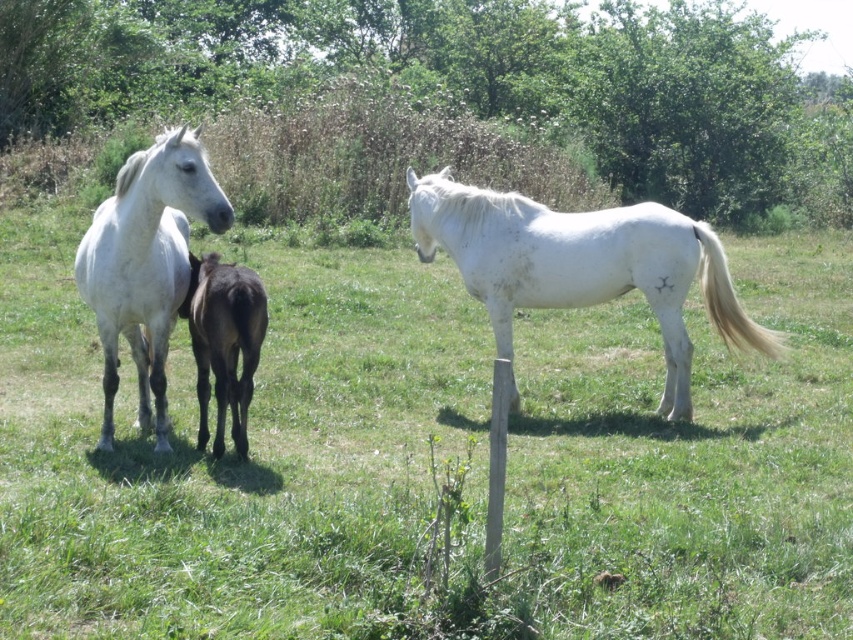
Does white matte horse at right have a lesser height compared to white glossy horse at left?

No, white matte horse at right is not shorter than white glossy horse at left.

Which is below, white matte horse at right or white glossy horse at left?

white matte horse at right

In order to click on white matte horse at right in this screenshot , I will do `click(582, 266)`.

Does white glossy horse at center lie in front of white matte horse at right?

Yes, white glossy horse at center is in front of white matte horse at right.

Describe the element at coordinates (230, 449) in the screenshot. I see `white glossy horse at center` at that location.

In order to click on white glossy horse at center in this screenshot , I will do `click(230, 449)`.

What do you see at coordinates (230, 449) in the screenshot?
I see `white glossy horse at center` at bounding box center [230, 449].

Does white glossy horse at center lie behind smooth wooden post at center?

No, it is in front of smooth wooden post at center.

Where is `white glossy horse at center`? Image resolution: width=853 pixels, height=640 pixels. white glossy horse at center is located at coordinates (230, 449).

Image resolution: width=853 pixels, height=640 pixels. Identify the location of white glossy horse at center. (230, 449).